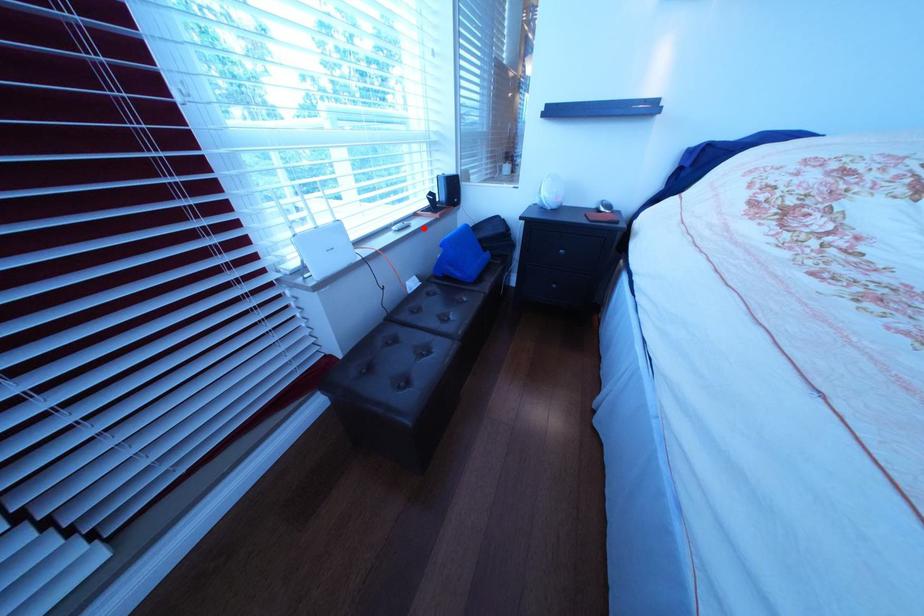
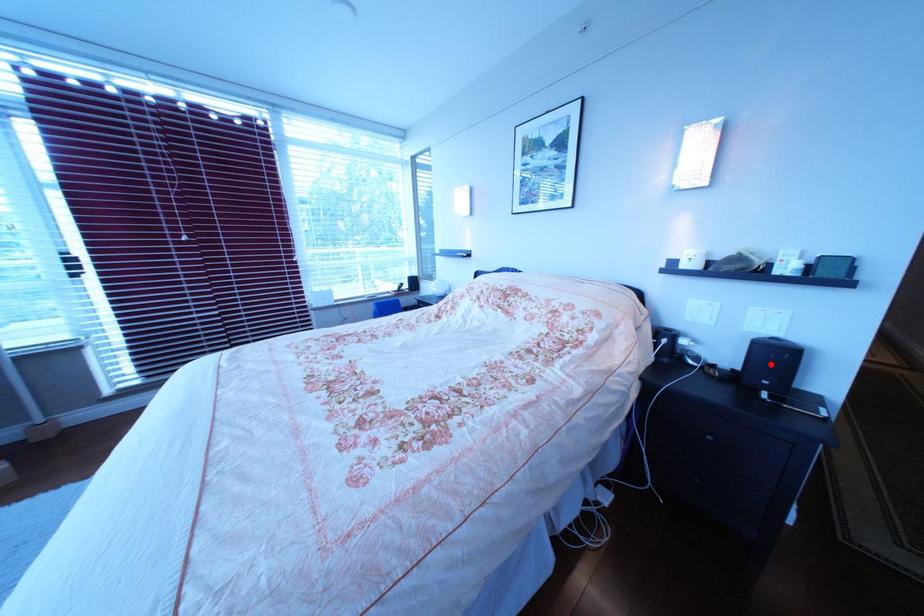
I am providing you with two images of the same scene from different viewpoints. A red point is marked on the first image and another point is marked on the second image. Is the marked point in image1 the same physical position as the marked point in image2?

No